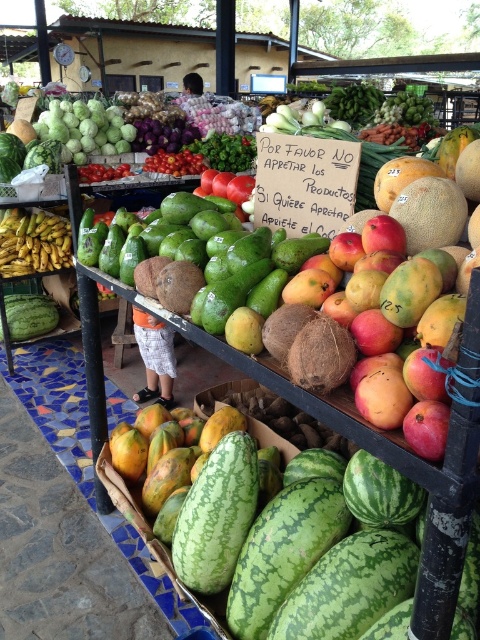
Which is more to the right, ripe mangoes at center or green matte watermelon at lower left?

Positioned to the right is ripe mangoes at center.

Is ripe mangoes at center positioned in front of green matte watermelon at lower left?

That is True.

The height and width of the screenshot is (640, 480). I want to click on ripe mangoes at center, so [x=396, y=330].

At what (x,y) coordinates should I click in order to perform the action: click on ripe mangoes at center. Please return your answer as a coordinate pair (x, y). The height and width of the screenshot is (640, 480). Looking at the image, I should click on (396, 330).

Image resolution: width=480 pixels, height=640 pixels. In order to click on green textured watermelon at center in this screenshot , I will do `click(288, 541)`.

Measure the distance between green textured watermelon at center and ripe mangoes at center.

green textured watermelon at center and ripe mangoes at center are 19.28 inches apart.

Between point (118, 474) and point (344, 310), which one is positioned in front?

Positioned in front is point (344, 310).

At what (x,y) coordinates should I click in order to perform the action: click on green textured watermelon at center. Please return your answer as a coordinate pair (x, y). Looking at the image, I should click on (288, 541).

Which is below, green textured watermelon at center or green matte watermelon at lower left?

green textured watermelon at center

Does green textured watermelon at center appear over green matte watermelon at lower left?

No.

At what (x,y) coordinates should I click in order to perform the action: click on green textured watermelon at center. Please return your answer as a coordinate pair (x, y). The height and width of the screenshot is (640, 480). Looking at the image, I should click on (288, 541).